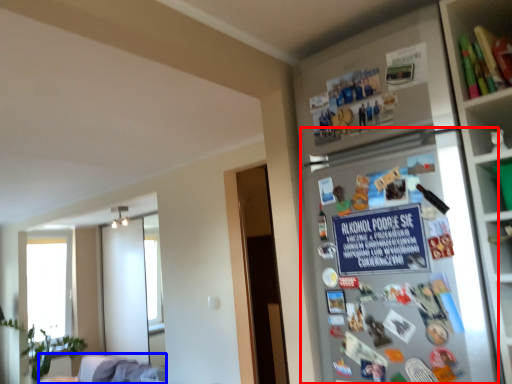
Question: Which point is further to the camera, fridge (highlighted by a red box) or furniture (highlighted by a blue box)?

Choices:
 (A) fridge
 (B) furniture

Answer: (B)